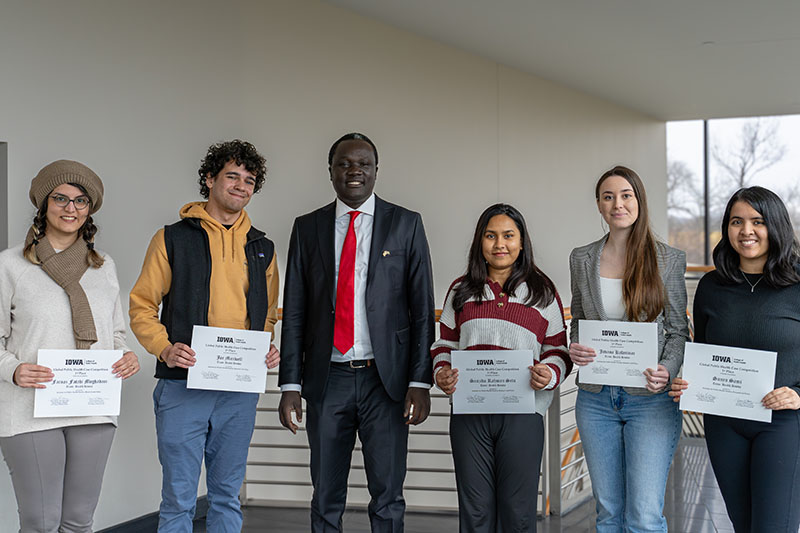
You are a GUI agent. You are given a task and a screenshot of the screen. Output one action in this format:
    pyautogui.click(x=<x>, y=<y>)
    Task: Click on the wall
    
    Given the screenshot: What is the action you would take?
    pyautogui.click(x=434, y=158)